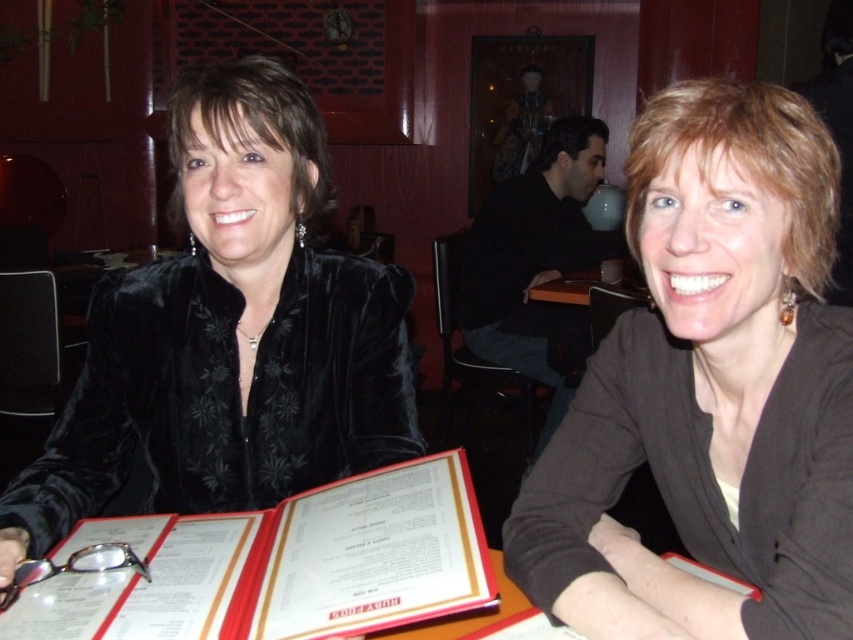
From the picture: You are a photographer trying to capture a closeup of the white paper menu at center without including the velvet black jacket at left in the frame. Based on their positions, is this possible?

The velvet black jacket at left is positioned on the left side of white paper menu at center, so if you move the camera to the right side of the menu, you can capture the white paper menu at center without including the jacket.

You are a photographer standing in front of the table. You want to take a photo of the white paper menu at center without the velvet black jacket at left blocking the view. Is it possible to do so without moving any objects?

The velvet black jacket at left is further to the viewer than the white paper menu at center, so it is blocking the menu. Therefore, it is not possible to take a photo of the white paper menu at center without the jacket blocking the view without moving any objects.

You are a photographer setting up for a portrait. You need to ensure that the brown matte jacket at center and the velvet black jacket at left are both visible in the frame. Based on their positions, which jacket should you focus on to ensure both are in focus?

The brown matte jacket at center is in front of the velvet black jacket at left, so focusing on the velvet black jacket at left will ensure both are in focus as it is further back.